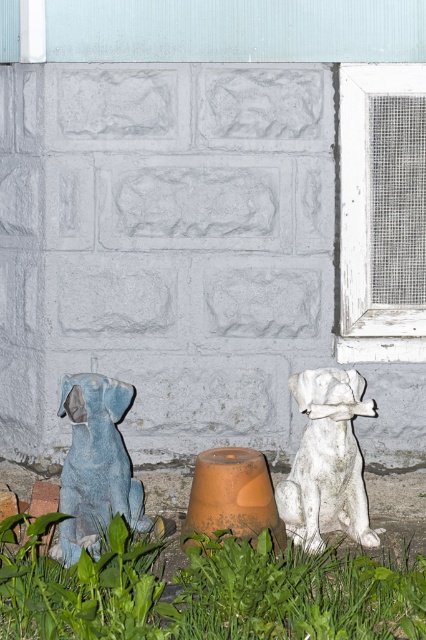
You are a delivery person who needs to place a package between the white matte dog at center and the matte blue statue at left. The package is 20 inches long. Is there enough space between them to fit the package?

The white matte dog at center is 22.36 inches from the matte blue statue at left, so yes, the package can fit between them since the distance between the two objects is greater than the package length.

You are a gardener planning to place a new flower pot that is 1 meter wide between the green leafy grass at lower center and the matte blue statue at left. Based on their widths, will the flower pot fit between them?

The green leafy grass at lower center is wider than the matte blue statue at left. Since the flower pot is 1 meter wide, it depends on the actual space between them. However, the question only provides information about their widths, not the distance between them. Therefore, we cannot determine if the flower pot will fit solely based on the given information.